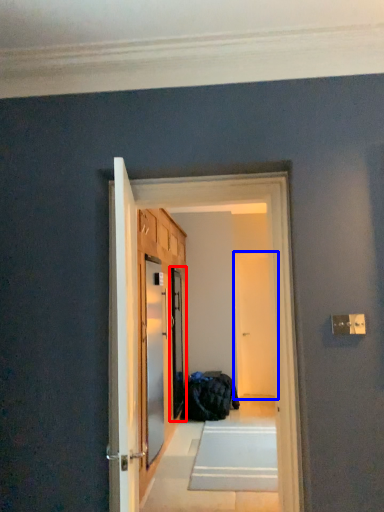
Question: Which of the following is the closest to the observer, screen door (highlighted by a red box) or screen door (highlighted by a blue box)?

Choices:
 (A) screen door
 (B) screen door

Answer: (A)